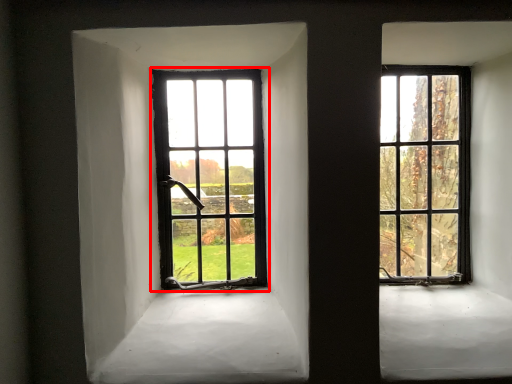
Question: Where is window (annotated by the red box) located in relation to window in the image?

Choices:
 (A) right
 (B) left

Answer: (B)